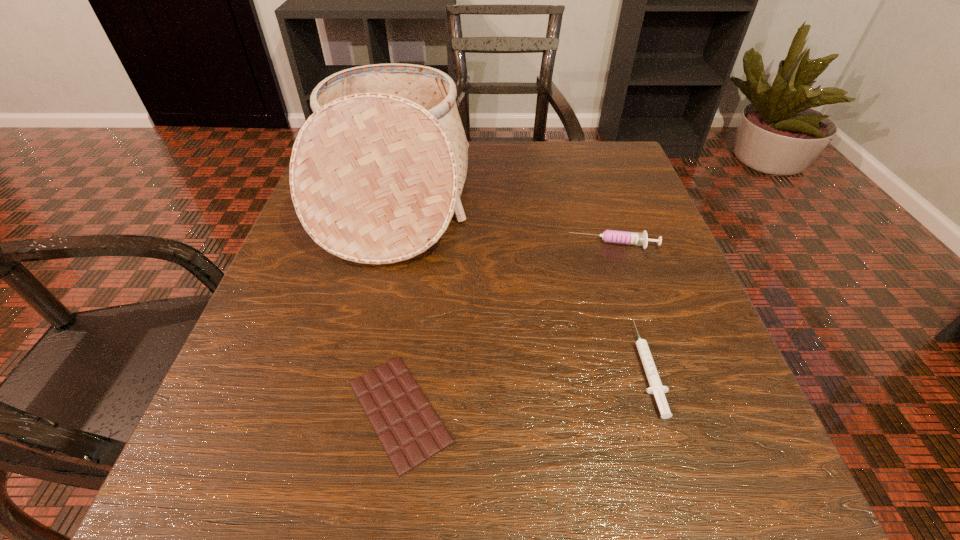
Identify the location of blank space that satisfies the following two spatial constraints: 1. with the lid open on the basket; 2. on the back side of the nearer syringe. The image size is (960, 540). (353, 367).

Where is `vacant space that satisfies the following two spatial constraints: 1. on the back side of the farther syringe; 2. on the right side of the nearer syringe`? The image size is (960, 540). vacant space that satisfies the following two spatial constraints: 1. on the back side of the farther syringe; 2. on the right side of the nearer syringe is located at coordinates (609, 245).

I want to click on vacant region that satisfies the following two spatial constraints: 1. with the lid open on the shorter syringe; 2. on the left side of the tallest object, so click(353, 367).

Locate an element on the screen. The image size is (960, 540). vacant region that satisfies the following two spatial constraints: 1. on the back side of the shorter syringe; 2. with the lid open on the tallest object is located at coordinates (594, 197).

Where is `vacant space that satisfies the following two spatial constraints: 1. on the back side of the shorter syringe; 2. on the left side of the taller syringe`? The height and width of the screenshot is (540, 960). vacant space that satisfies the following two spatial constraints: 1. on the back side of the shorter syringe; 2. on the left side of the taller syringe is located at coordinates pos(609,245).